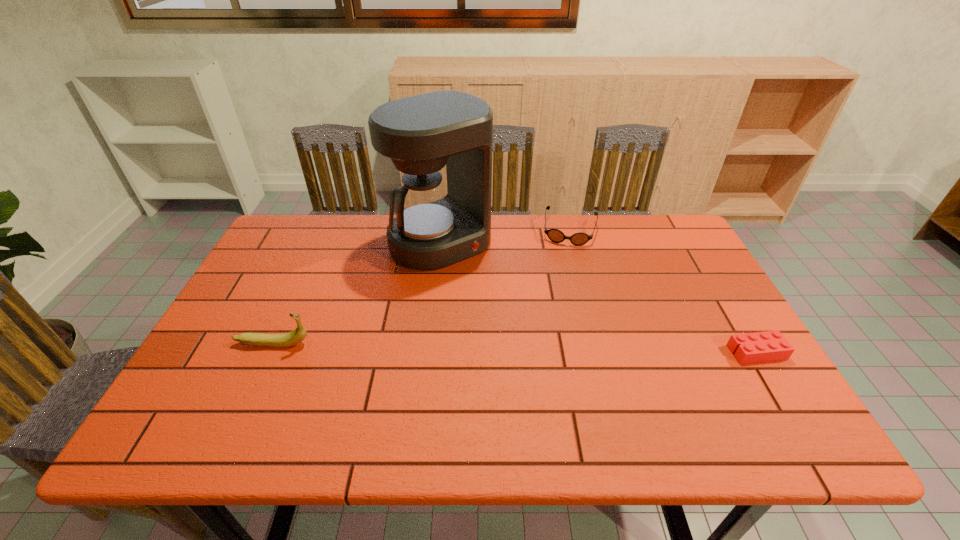
At what (x,y) coordinates should I click in order to perform the action: click on the third shortest object. Please return your answer as a coordinate pair (x, y). The image size is (960, 540). Looking at the image, I should click on (298, 335).

Find the location of a particular element. The width and height of the screenshot is (960, 540). the leftmost object is located at coordinates (298, 335).

Locate an element on the screen. The image size is (960, 540). the shortest object is located at coordinates (769, 346).

Locate an element on the screen. This screenshot has height=540, width=960. Lego is located at coordinates (769, 346).

Locate an element on the screen. The width and height of the screenshot is (960, 540). coffee maker is located at coordinates (436, 225).

Where is `the tallest object`? the tallest object is located at coordinates (436, 225).

Locate an element on the screen. The height and width of the screenshot is (540, 960). the second object from right to left is located at coordinates (555, 235).

Where is `sunglasses`? The image size is (960, 540). sunglasses is located at coordinates (555, 235).

The image size is (960, 540). What are the coordinates of `free space located 0.400m at the stem of the leftmost object` in the screenshot? It's located at (474, 343).

The width and height of the screenshot is (960, 540). In order to click on free space located on the left of the rightmost object in this screenshot , I will do `click(659, 353)`.